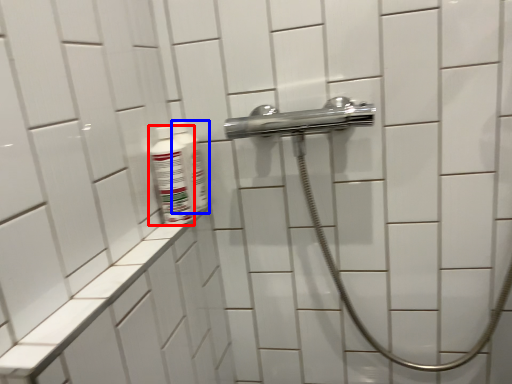
Question: Which point is closer to the camera, mouthwash (highlighted by a red box) or mouthwash (highlighted by a blue box)?

Choices:
 (A) mouthwash
 (B) mouthwash

Answer: (A)